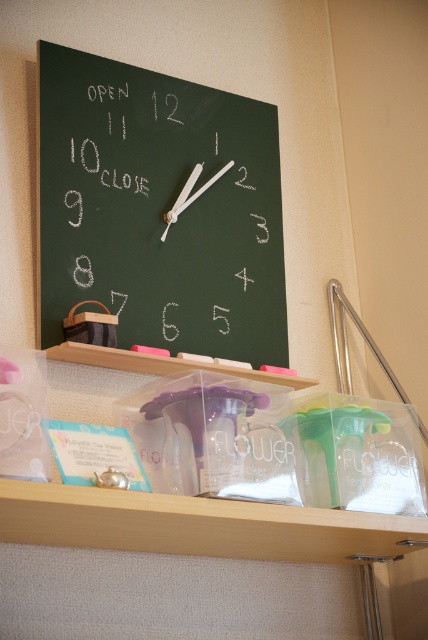
You are standing in the room and want to locate the chalkboard at upper center. According to the coordinates given, where should you look relative to the center of the image?

The chalkboard at upper center is located at coordinates point 0.330 on the x axis and 0.371 on the y axis, so it is slightly to the left and above the center of the image.

You are an interior designer assessing the wall space in the room. The chalkboard at upper center and the clear plastic shelf at lower center are both mounted on the same wall. Based on their sizes, which object would require more wall space to accommodate?

The chalkboard at upper center requires more wall space because it is larger in size than the clear plastic shelf at lower center.